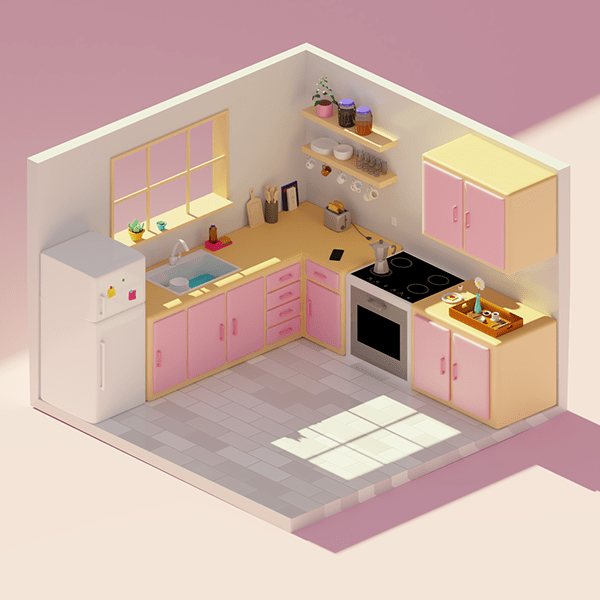
Image resolution: width=600 pixels, height=600 pixels. In order to click on white door handle on freezer in this screenshot , I will do `click(100, 303)`.